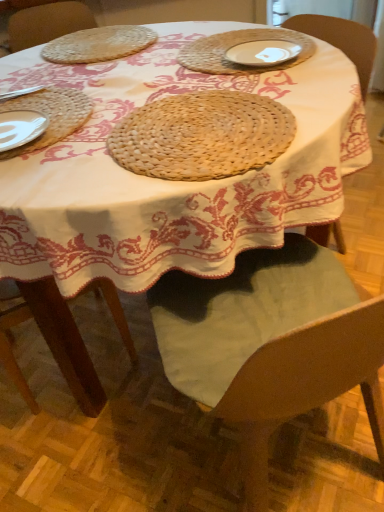
Question: Can you confirm if white ceramic plate at upper center is smaller than natural woven placemat at center, which is the 1th pie from bottom to top?

Choices:
 (A) no
 (B) yes

Answer: (B)

Question: Is white ceramic plate at upper center positioned beyond the bounds of natural woven placemat at center, placed as the second pie when sorted from top to bottom?

Choices:
 (A) yes
 (B) no

Answer: (A)

Question: Considering the relative sizes of white ceramic plate at upper center and natural woven placemat at center, the 1th pie in the front-to-back sequence, in the image provided, is white ceramic plate at upper center shorter than natural woven placemat at center, the 1th pie in the front-to-back sequence,?

Choices:
 (A) yes
 (B) no

Answer: (A)

Question: From the image's perspective, is white ceramic plate at upper center under natural woven placemat at center, the 1th pie in the front-to-back sequence?

Choices:
 (A) no
 (B) yes

Answer: (A)

Question: Is natural woven placemat at center, which is the 1th pie from bottom to top, completely or partially inside white ceramic plate at upper center?

Choices:
 (A) no
 (B) yes

Answer: (A)

Question: Are white ceramic plate at upper center and natural woven placemat at center, which is the 1th pie from bottom to top, located far from each other?

Choices:
 (A) no
 (B) yes

Answer: (A)

Question: From a real-world perspective, does woven straw placemat at left sit lower than natural woven placemat at center, the 1th pie in the front-to-back sequence?

Choices:
 (A) no
 (B) yes

Answer: (A)

Question: Is woven straw placemat at left positioned behind natural woven placemat at center, which is the 1th pie from bottom to top?

Choices:
 (A) no
 (B) yes

Answer: (B)

Question: Does woven straw placemat at left have a lesser height compared to natural woven placemat at center, the 1th pie in the front-to-back sequence?

Choices:
 (A) no
 (B) yes

Answer: (A)

Question: Can you confirm if woven straw placemat at left is taller than natural woven placemat at center, placed as the second pie when sorted from top to bottom?

Choices:
 (A) yes
 (B) no

Answer: (B)

Question: Does woven straw placemat at left have a greater width compared to natural woven placemat at center, the 1th pie in the front-to-back sequence?

Choices:
 (A) yes
 (B) no

Answer: (B)

Question: Does woven straw placemat at left appear on the left side of natural woven placemat at center, the 1th pie in the front-to-back sequence?

Choices:
 (A) yes
 (B) no

Answer: (A)

Question: Can you confirm if woven straw placemat at upper left, the first pie from the back, is taller than white ceramic plate at upper center?

Choices:
 (A) yes
 (B) no

Answer: (A)